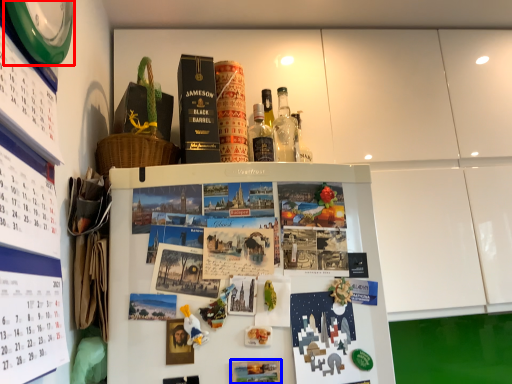
Question: Which point is closer to the camera, clock (highlighted by a red box) or book cover (highlighted by a blue box)?

Choices:
 (A) clock
 (B) book cover

Answer: (A)